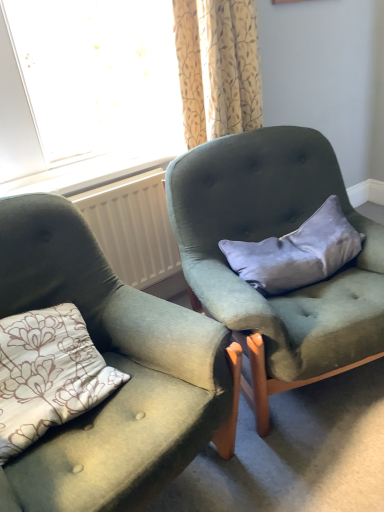
Question: From a real-world perspective, is white plastic radiator at center below velvet gray pillow at center?

Choices:
 (A) no
 (B) yes

Answer: (B)

Question: Is white plastic radiator at center positioned beyond the bounds of velvet gray pillow at center?

Choices:
 (A) yes
 (B) no

Answer: (A)

Question: Does white plastic radiator at center have a greater width compared to velvet gray pillow at center?

Choices:
 (A) yes
 (B) no

Answer: (B)

Question: Is white plastic radiator at center to the right of velvet gray pillow at center from the viewer's perspective?

Choices:
 (A) no
 (B) yes

Answer: (A)

Question: Can you confirm if white plastic radiator at center is smaller than velvet gray pillow at center?

Choices:
 (A) no
 (B) yes

Answer: (B)

Question: Visually, is white plastic radiator at center positioned to the left or to the right of velvet gray pillow at center?

Choices:
 (A) right
 (B) left

Answer: (B)

Question: Considering the positions of white plastic radiator at center and velvet gray pillow at center in the image, is white plastic radiator at center taller or shorter than velvet gray pillow at center?

Choices:
 (A) tall
 (B) short

Answer: (A)

Question: In terms of size, does white plastic radiator at center appear bigger or smaller than velvet gray pillow at center?

Choices:
 (A) big
 (B) small

Answer: (B)

Question: From the image's perspective, is white plastic radiator at center above or below velvet gray pillow at center?

Choices:
 (A) above
 (B) below

Answer: (A)

Question: From a real-world perspective, is velvet green armchair at center, which is the 2th chair in right-to-left order, physically located above or below velvet gray pillow at center?

Choices:
 (A) above
 (B) below

Answer: (B)

Question: Is point (192, 333) positioned closer to the camera than point (339, 224)?

Choices:
 (A) farther
 (B) closer

Answer: (B)

Question: In terms of width, does velvet green armchair at center, which is the 2th chair in right-to-left order, look wider or thinner when compared to velvet gray pillow at center?

Choices:
 (A) wide
 (B) thin

Answer: (A)

Question: Considering their positions, is velvet green armchair at center, which is the 2th chair in right-to-left order, located in front of or behind velvet gray pillow at center?

Choices:
 (A) behind
 (B) front

Answer: (B)

Question: Is velvet green armchair at center, which is counted as the second chair, starting from the left, taller or shorter than velvet green armchair at center, acting as the 1th chair starting from the left?

Choices:
 (A) tall
 (B) short

Answer: (A)

Question: Is velvet green armchair at center, which is counted as the second chair, starting from the left, in front of or behind velvet green armchair at center, acting as the 1th chair starting from the left, in the image?

Choices:
 (A) front
 (B) behind

Answer: (B)